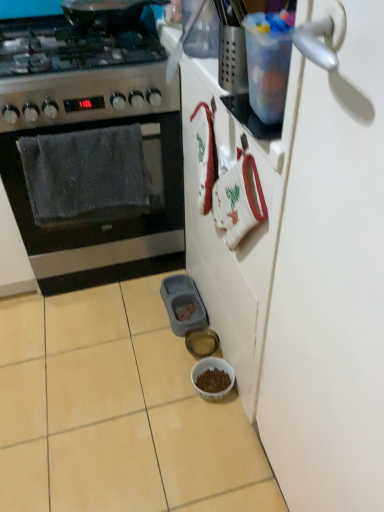
Question: Based on their positions, is stainless steel gas stove at left located to the left or right of translucent glass bowl at lower center, the 2th bowl in the front-to-back sequence?

Choices:
 (A) left
 (B) right

Answer: (A)

Question: Considering the positions of stainless steel gas stove at left and translucent glass bowl at lower center, the first bowl from the back, in the image, is stainless steel gas stove at left wider or thinner than translucent glass bowl at lower center, the first bowl from the back,?

Choices:
 (A) wide
 (B) thin

Answer: (A)

Question: Which is farther from the gray plastic pet food container at lower center?

Choices:
 (A) white matte door at right
 (B) translucent glass bowl at lower center, the 2th bowl in the front-to-back sequence
 (C) brown matte bowl at lower center, which is counted as the 2th bowl, starting from the back
 (D) stainless steel gas stove at left
 (E) stainless steel oven at left

Answer: (A)

Question: Estimate the real-world distances between objects in this image. Which object is farther from the translucent glass bowl at lower center, the 2th bowl in the front-to-back sequence?

Choices:
 (A) stainless steel oven at left
 (B) white matte door at right
 (C) gray plastic pet food container at lower center
 (D) brown matte bowl at lower center, which is counted as the 2th bowl, starting from the back
 (E) stainless steel gas stove at left

Answer: (E)